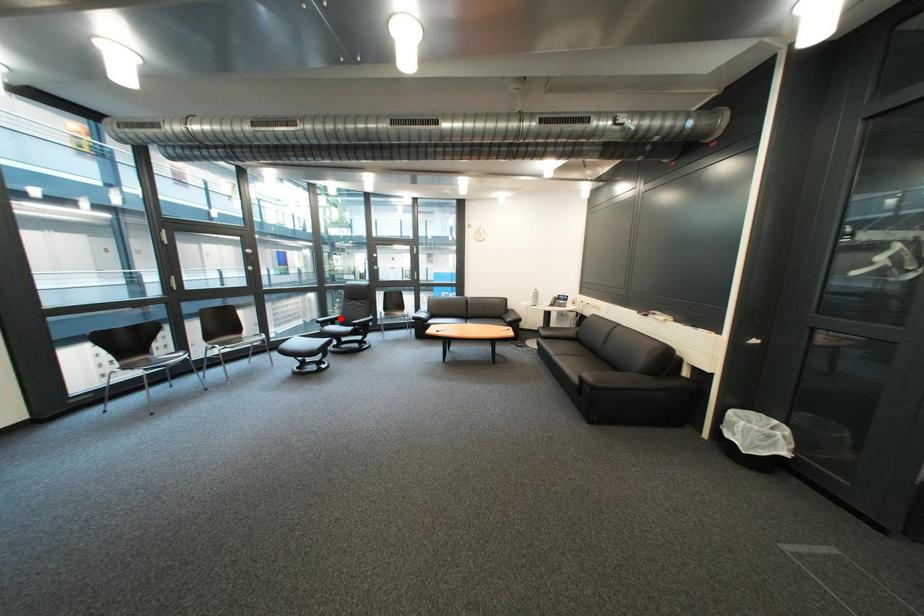
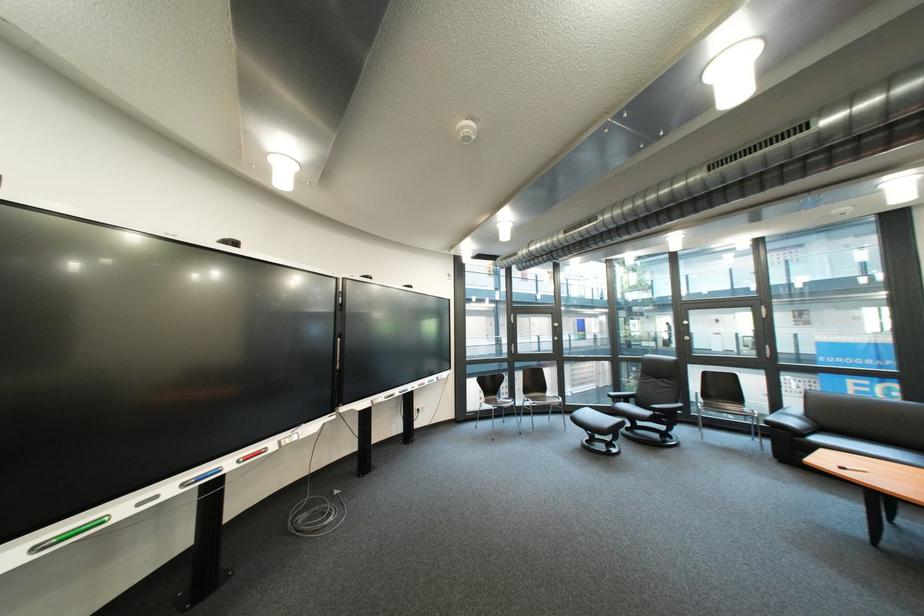
Locate, in the second image, the point that corresponds to the highlighted location in the first image.

(634, 392)